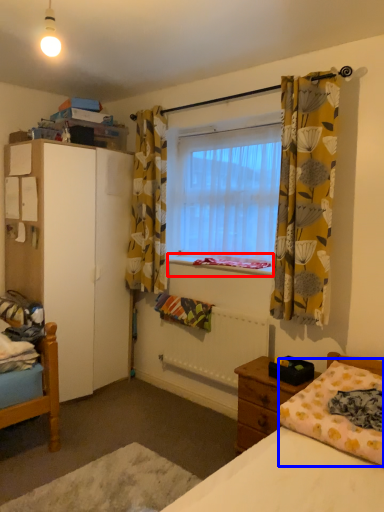
Question: Which object is further to the camera taking this photo, window sill (highlighted by a red box) or mattress (highlighted by a blue box)?

Choices:
 (A) window sill
 (B) mattress

Answer: (A)